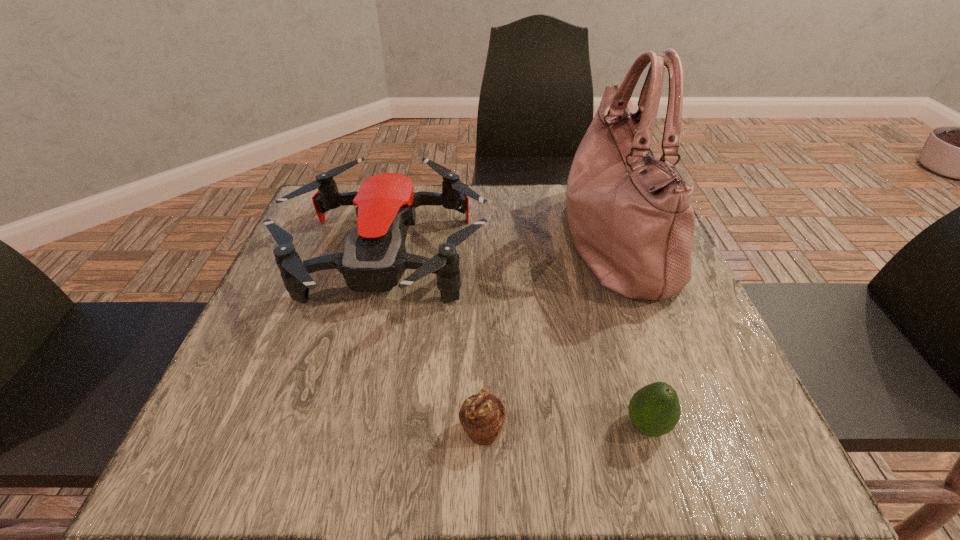
This screenshot has height=540, width=960. Find the location of `handbag at the far edge`. handbag at the far edge is located at coordinates (631, 220).

The height and width of the screenshot is (540, 960). In order to click on drone present at the far edge in this screenshot , I will do `click(374, 258)`.

Locate an element on the screen. Image resolution: width=960 pixels, height=540 pixels. avocado situated at the near edge is located at coordinates (654, 410).

Find the location of `muffin positioned at the near edge`. muffin positioned at the near edge is located at coordinates (482, 415).

Locate an element on the screen. object positioned at the left edge is located at coordinates (374, 258).

You are a GUI agent. You are given a task and a screenshot of the screen. Output one action in this format:
    pyautogui.click(x=<x>, y=<y>)
    Task: Click on the handbag that is at the right edge
    The height and width of the screenshot is (540, 960).
    Given the screenshot: What is the action you would take?
    pyautogui.click(x=631, y=220)

At what (x,y) coordinates should I click in order to perform the action: click on avocado at the right edge. Please return your answer as a coordinate pair (x, y). The height and width of the screenshot is (540, 960). Looking at the image, I should click on (654, 410).

The image size is (960, 540). Identify the location of object situated at the far left corner. (374, 258).

Find the location of a particular element. object positioned at the far right corner is located at coordinates (631, 220).

Locate an element on the screen. object present at the near right corner is located at coordinates (654, 410).